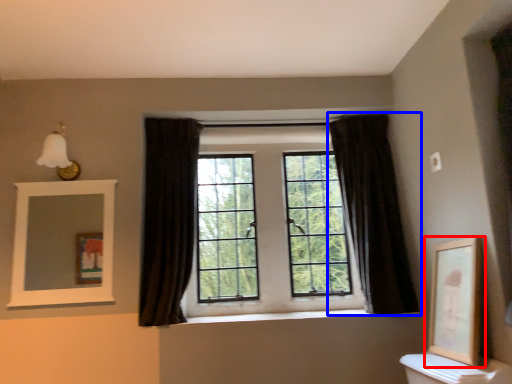
Question: Which point is closer to the camera, picture frame (highlighted by a red box) or curtain (highlighted by a blue box)?

Choices:
 (A) picture frame
 (B) curtain

Answer: (A)